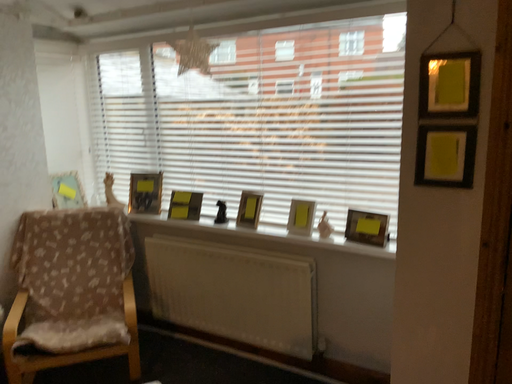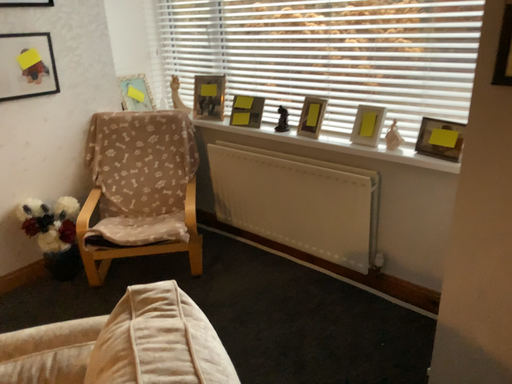
Question: Which way did the camera rotate in the video?

Choices:
 (A) rotated right
 (B) rotated left

Answer: (B)